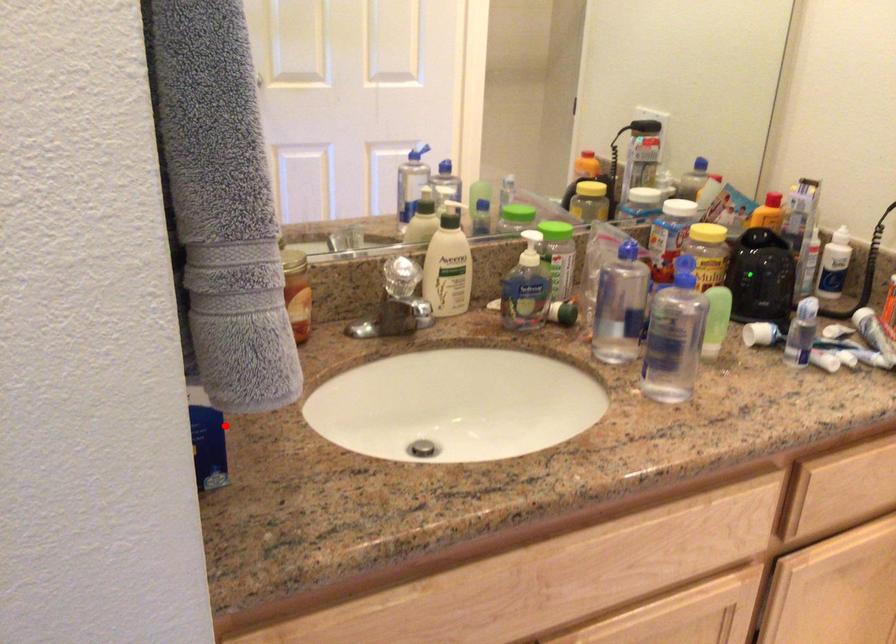
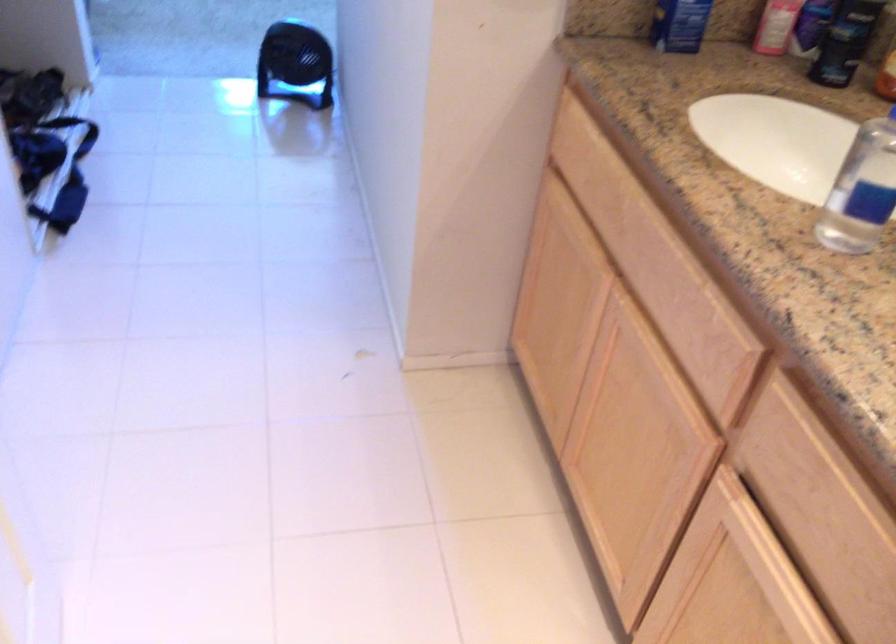
Question: I am providing you with two images of the same scene from different viewpoints. A red point is shown in image1. For the corresponding object point in image2, is it positioned nearer or farther from the camera?

Choices:
 (A) Nearer
 (B) Farther

Answer: (B)